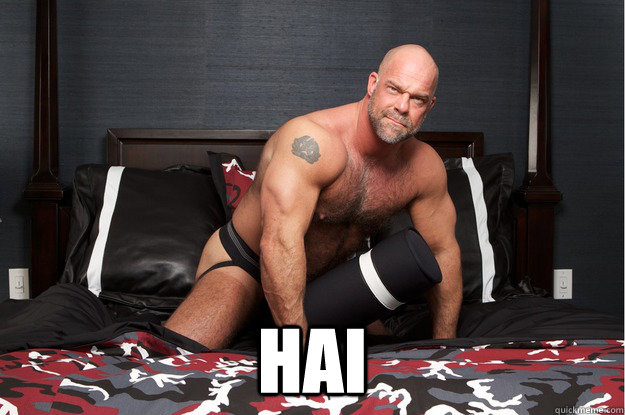
This screenshot has width=625, height=415. Find the location of `bed`. bed is located at coordinates (457, 388).